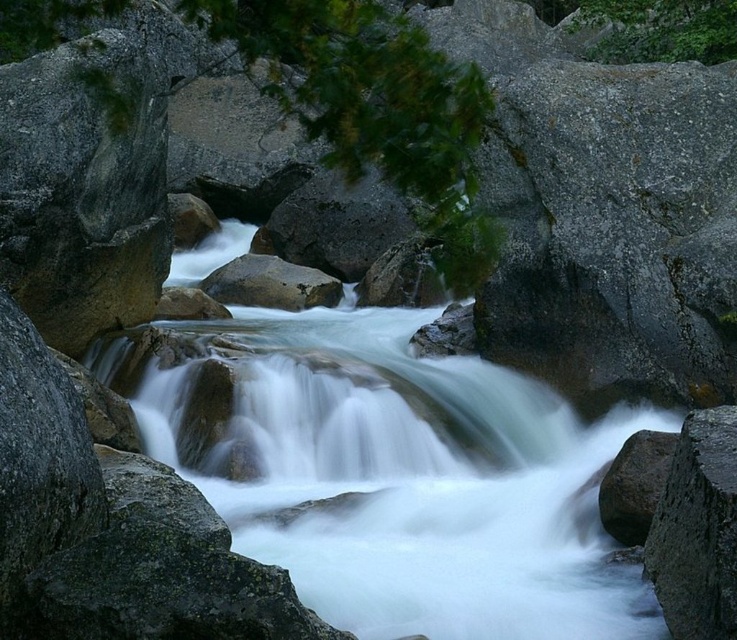
Based on the scene description, where is the white smooth water at center located in the image?

The white smooth water at center is located at point coordinates of (x=415, y=484).